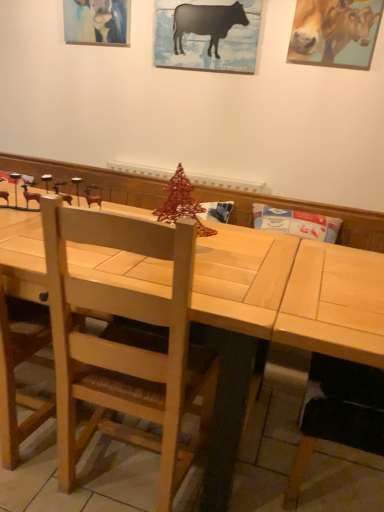
Question: From the image's perspective, is golden glossy cow at upper right, the second cattle positioned from the left, under matte acrylic painting at upper left?

Choices:
 (A) yes
 (B) no

Answer: (A)

Question: Is matte acrylic painting at upper left a part of golden glossy cow at upper right, which is the 1th cattle from right to left?

Choices:
 (A) no
 (B) yes

Answer: (A)

Question: Is golden glossy cow at upper right, which is the 1th cattle from right to left, located outside matte acrylic painting at upper left?

Choices:
 (A) yes
 (B) no

Answer: (A)

Question: From a real-world perspective, is golden glossy cow at upper right, which is the 1th cattle from right to left, beneath matte acrylic painting at upper left?

Choices:
 (A) no
 (B) yes

Answer: (A)

Question: Is golden glossy cow at upper right, which is the 1th cattle from right to left, further to the viewer compared to matte acrylic painting at upper left?

Choices:
 (A) yes
 (B) no

Answer: (B)

Question: Is light wood table at center spatially inside golden glossy cow at upper right, which is the 1th cattle from right to left, or outside of it?

Choices:
 (A) inside
 (B) outside

Answer: (B)

Question: From a real-world perspective, is light wood table at center physically located above or below golden glossy cow at upper right, which is the 1th cattle from right to left?

Choices:
 (A) below
 (B) above

Answer: (A)

Question: Considering the positions of light wood table at center and golden glossy cow at upper right, the second cattle positioned from the left, in the image, is light wood table at center wider or thinner than golden glossy cow at upper right, the second cattle positioned from the left,?

Choices:
 (A) thin
 (B) wide

Answer: (B)

Question: In the image, is light wood table at center positioned in front of or behind golden glossy cow at upper right, the second cattle positioned from the left?

Choices:
 (A) front
 (B) behind

Answer: (A)

Question: From a real-world perspective, relative to black matte/ceramic cow at upper center, the second cattle when ordered from right to left, is matte acrylic painting at upper left vertically above or below?

Choices:
 (A) above
 (B) below

Answer: (A)

Question: Relative to black matte/ceramic cow at upper center, the second cattle when ordered from right to left, is matte acrylic painting at upper left in front or behind?

Choices:
 (A) behind
 (B) front

Answer: (A)

Question: From the image's perspective, relative to black matte/ceramic cow at upper center, which ranks as the 1th cattle in left-to-right order, is matte acrylic painting at upper left above or below?

Choices:
 (A) below
 (B) above

Answer: (B)

Question: Is matte acrylic painting at upper left inside the boundaries of black matte/ceramic cow at upper center, which ranks as the 1th cattle in left-to-right order, or outside?

Choices:
 (A) inside
 (B) outside

Answer: (B)

Question: From the image's perspective, is light brown wooden chair at center above or below light wood table at center?

Choices:
 (A) above
 (B) below

Answer: (B)

Question: Is light brown wooden chair at center inside or outside of light wood table at center?

Choices:
 (A) outside
 (B) inside

Answer: (B)